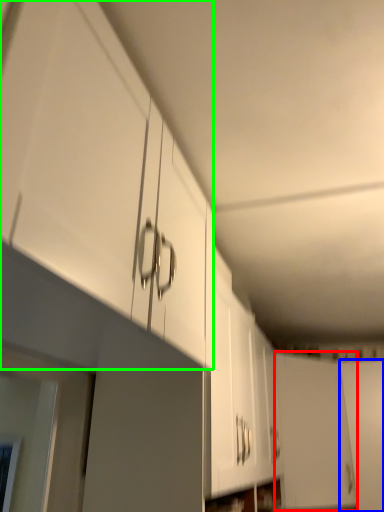
Question: Estimate the real-world distances between objects in this image. Which object is farther from door (highlighted by a red box), door (highlighted by a blue box) or cabinetry (highlighted by a green box)?

Choices:
 (A) door
 (B) cabinetry

Answer: (B)